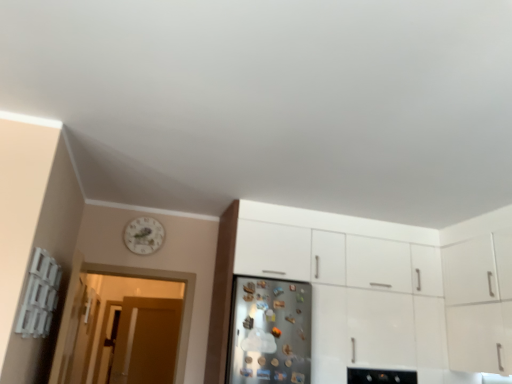
Question: Looking at their shapes, would you say brown matte door at left is wider or thinner than translucent wooden door at left?

Choices:
 (A) thin
 (B) wide

Answer: (B)

Question: Considering the positions of point (139, 332) and point (98, 334), is point (139, 332) closer or farther from the camera than point (98, 334)?

Choices:
 (A) closer
 (B) farther

Answer: (B)

Question: Based on their relative distances, which object is nearer to the white glossy clock at upper left?

Choices:
 (A) white glossy cabinet at center
 (B) brown matte door at left
 (C) translucent wooden door at left
 (D) satin silver fridge at center

Answer: (C)

Question: Which of these objects is positioned closest to the brown matte door at left?

Choices:
 (A) white glossy cabinet at center
 (B) translucent wooden door at left
 (C) satin silver fridge at center
 (D) white glossy clock at upper left

Answer: (B)